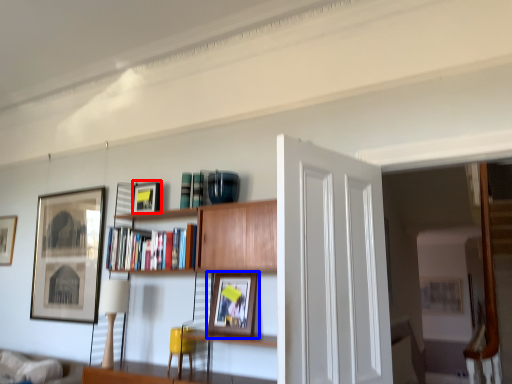
Question: Among these objects, which one is nearest to the camera, picture frame (highlighted by a red box) or picture frame (highlighted by a blue box)?

Choices:
 (A) picture frame
 (B) picture frame

Answer: (B)